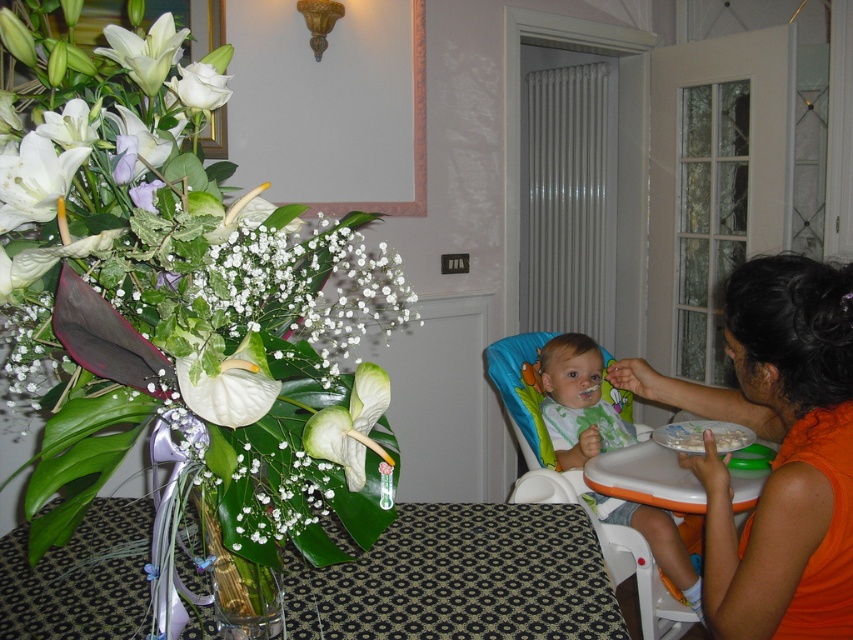
You are standing at the point labeled point (189, 84) and want to walk to the point labeled point (206, 522). Which direction should you face to move towards your destination?

You should face towards the direction of point (206, 522), which is behind point (189, 84), so you need to walk backwards or turn around to reach it.

You are a guest sitting at the table and want to reach both the translucent glass vase at lower left and the white matte rose at upper left. Which object will you need to reach further to get?

You will need to reach further to get the white matte rose at upper left because the translucent glass vase at lower left is closer to you, while the white matte rose at upper left is farther away.

You are standing at the center of the dining table and want to place a small candle holder on the table. The candle holder requires a space that is at least 10 cm in diameter. Can you place it at point (x=459, y=577)?

The point (x=459, y=577) is occupied by a translucent glass vase at lower left, so you cannot place the candle holder there.